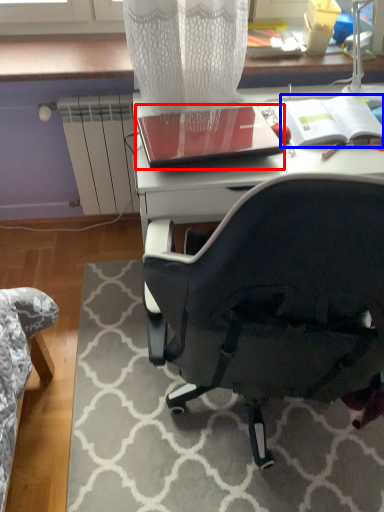
Question: Which of the following is the farthest to the observer, notebook (highlighted by a red box) or notebook (highlighted by a blue box)?

Choices:
 (A) notebook
 (B) notebook

Answer: (B)